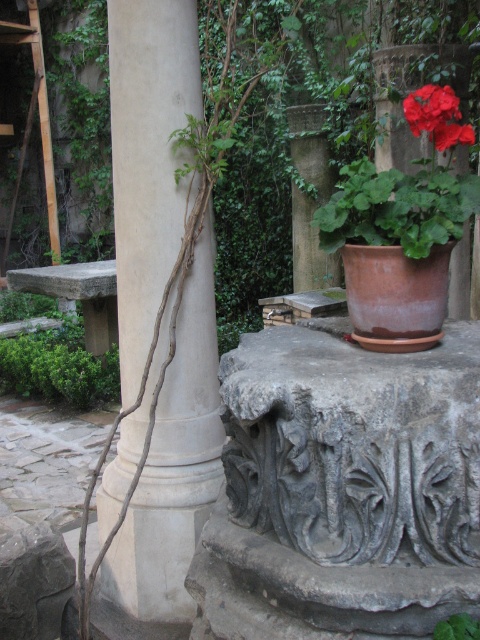
You are standing in the courtyard and want to place a small statue between the white stone column at center and the green leafy plant at center. Based on their positions, which object should the statue be closer to if it needs to be aligned with the center of the courtyard?

The statue should be closer to the green leafy plant at center because the white stone column at center is to the left of the green leafy plant at center, meaning the plant is closer to the center of the courtyard.

Looking at this image, you are standing in the courtyard and want to take a photo of the white stone column at center. If your camera can focus on objects up to 2 meters away, will it be able to capture the column clearly?

The white stone column at center is 2.15 meters from the camera, which is beyond the camera focus range of 2 meters. Therefore, the camera cannot focus on it clearly.